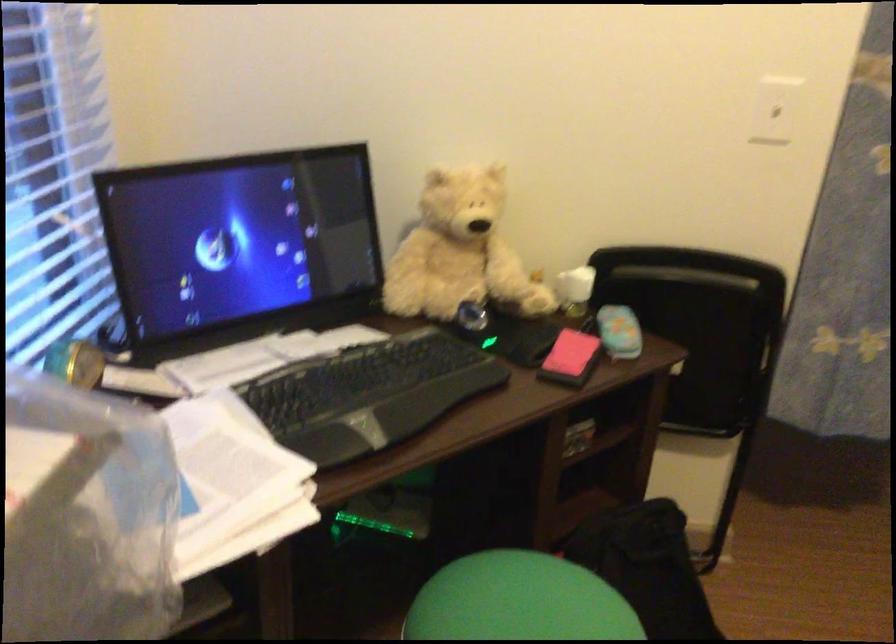
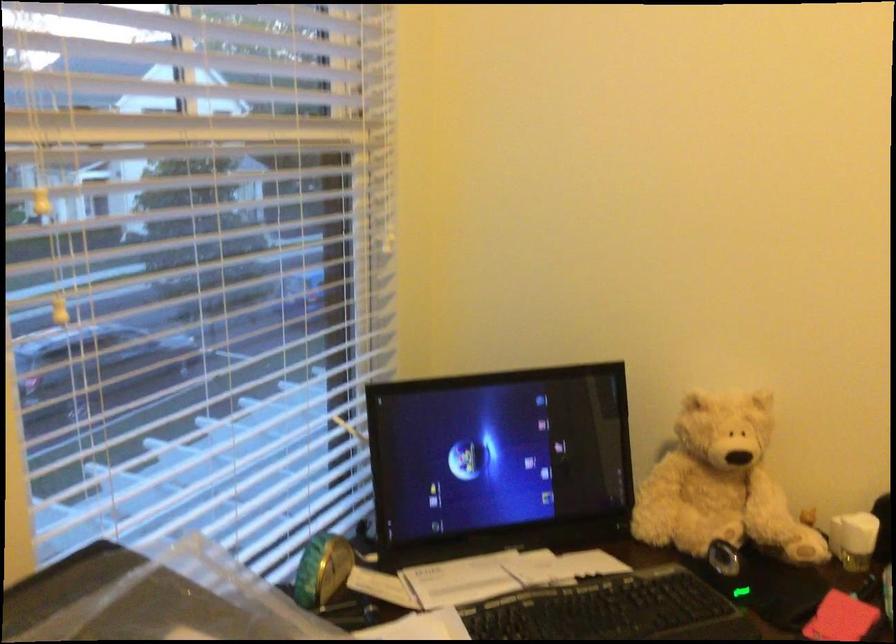
Locate, in the second image, the point that corresponds to (x=572, y=351) in the first image.

(840, 618)